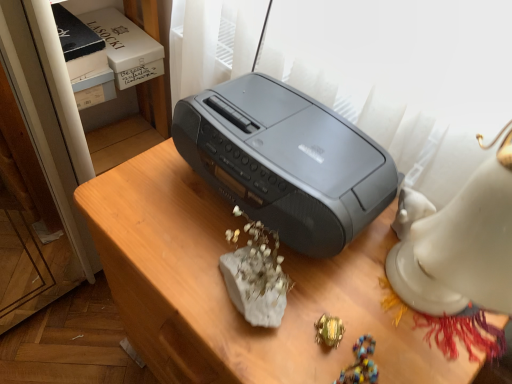
Question: Is slate gray plastic printer at center bigger than satin gray radio at center?

Choices:
 (A) no
 (B) yes

Answer: (A)

Question: Is slate gray plastic printer at center to the right of satin gray radio at center from the viewer's perspective?

Choices:
 (A) yes
 (B) no

Answer: (A)

Question: From a real-world perspective, is slate gray plastic printer at center on satin gray radio at center?

Choices:
 (A) no
 (B) yes

Answer: (B)

Question: From the image's perspective, is slate gray plastic printer at center located beneath satin gray radio at center?

Choices:
 (A) yes
 (B) no

Answer: (B)

Question: Does slate gray plastic printer at center lie behind satin gray radio at center?

Choices:
 (A) yes
 (B) no

Answer: (A)

Question: Is slate gray plastic printer at center not near satin gray radio at center?

Choices:
 (A) no
 (B) yes

Answer: (A)

Question: Does green metallic ring at lower center have a smaller size compared to slate gray plastic printer at center?

Choices:
 (A) no
 (B) yes

Answer: (B)

Question: Considering the relative sizes of green metallic ring at lower center and slate gray plastic printer at center in the image provided, is green metallic ring at lower center shorter than slate gray plastic printer at center?

Choices:
 (A) yes
 (B) no

Answer: (A)

Question: Does green metallic ring at lower center have a greater height compared to slate gray plastic printer at center?

Choices:
 (A) no
 (B) yes

Answer: (A)

Question: From a real-world perspective, is green metallic ring at lower center positioned over slate gray plastic printer at center based on gravity?

Choices:
 (A) yes
 (B) no

Answer: (B)

Question: Could you tell me if green metallic ring at lower center is turned towards slate gray plastic printer at center?

Choices:
 (A) yes
 (B) no

Answer: (B)

Question: Considering the relative sizes of green metallic ring at lower center and slate gray plastic printer at center in the image provided, is green metallic ring at lower center wider than slate gray plastic printer at center?

Choices:
 (A) yes
 (B) no

Answer: (B)

Question: From the image's perspective, is satin gray radio at center above green metallic ring at lower center?

Choices:
 (A) no
 (B) yes

Answer: (A)